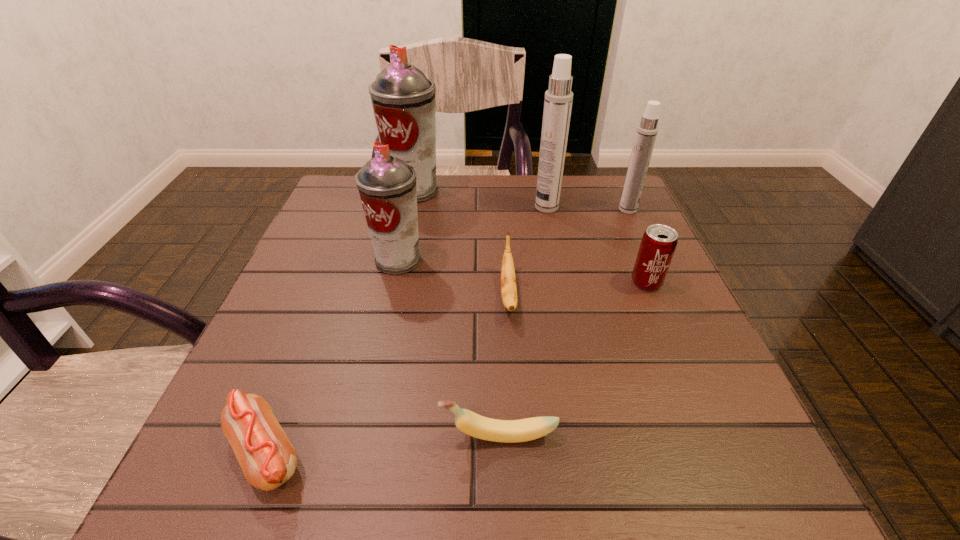
Locate an element on the screen. the shortest object is located at coordinates (268, 459).

Identify the location of brown sausage. (268, 459).

Where is `vacant region located 0.360m on the right of the bigger gray aerosol can`? vacant region located 0.360m on the right of the bigger gray aerosol can is located at coordinates (575, 191).

The image size is (960, 540). In order to click on vacant space located 0.270m on the front of the left white aerosol can in this screenshot , I will do `click(564, 286)`.

This screenshot has width=960, height=540. Find the location of `free space located on the front of the smaller white aerosol can`. free space located on the front of the smaller white aerosol can is located at coordinates (665, 291).

Find the location of `free spot located on the front of the nearer gray aerosol can`. free spot located on the front of the nearer gray aerosol can is located at coordinates (383, 327).

Identify the location of free space located on the left of the fourth shortest object. (442, 282).

The height and width of the screenshot is (540, 960). Identify the location of free space located 0.150m on the peel of the farther banana from the top. (516, 395).

Find the location of a particular element. This screenshot has width=960, height=540. free space located 0.250m at the stem of the nearer yellow banana is located at coordinates (273, 436).

Where is `free region located 0.170m at the stem of the nearer yellow banana`? free region located 0.170m at the stem of the nearer yellow banana is located at coordinates (326, 436).